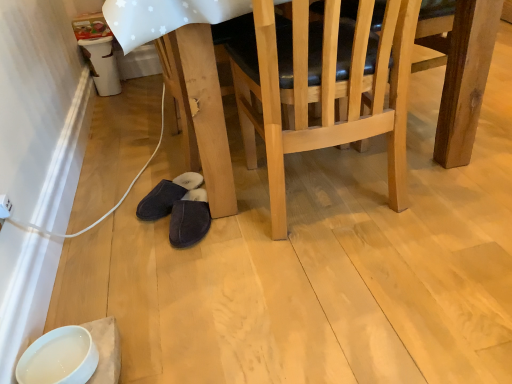
Question: From a real-world perspective, is dark suede slippers at lower center, the first footwear when ordered from right to left, positioned over natural wood chair at center based on gravity?

Choices:
 (A) no
 (B) yes

Answer: (A)

Question: Is dark suede slippers at lower center, arranged as the second footwear when viewed from the left, beside natural wood chair at center?

Choices:
 (A) no
 (B) yes

Answer: (A)

Question: From the image's perspective, is dark suede slippers at lower center, the first footwear when ordered from right to left, under natural wood chair at center?

Choices:
 (A) no
 (B) yes

Answer: (B)

Question: Is dark suede slippers at lower center, the first footwear when ordered from right to left, at the right side of natural wood chair at center?

Choices:
 (A) no
 (B) yes

Answer: (A)

Question: Can you confirm if dark suede slippers at lower center, the first footwear when ordered from right to left, is thinner than natural wood chair at center?

Choices:
 (A) no
 (B) yes

Answer: (B)

Question: From the image's perspective, is wooden table at lower center positioned above or below dark suede slippers at lower center, the first footwear when ordered from right to left?

Choices:
 (A) below
 (B) above

Answer: (B)

Question: In the image, is wooden table at lower center positioned in front of or behind dark suede slippers at lower center, arranged as the second footwear when viewed from the left?

Choices:
 (A) front
 (B) behind

Answer: (A)

Question: Choose the correct answer: Is wooden table at lower center inside dark suede slippers at lower center, the first footwear when ordered from right to left, or outside it?

Choices:
 (A) outside
 (B) inside

Answer: (A)

Question: Does point (115, 29) appear closer or farther from the camera than point (187, 228)?

Choices:
 (A) closer
 (B) farther

Answer: (A)

Question: Considering the positions of point (185, 205) and point (192, 51), is point (185, 205) closer or farther from the camera than point (192, 51)?

Choices:
 (A) closer
 (B) farther

Answer: (B)

Question: Is dark suede slippers at lower center, the first footwear when ordered from right to left, to the left or to the right of wooden table at lower center in the image?

Choices:
 (A) left
 (B) right

Answer: (A)

Question: In terms of width, does dark suede slippers at lower center, arranged as the second footwear when viewed from the left, look wider or thinner when compared to wooden table at lower center?

Choices:
 (A) wide
 (B) thin

Answer: (B)

Question: From a real-world perspective, relative to wooden table at lower center, is dark suede slippers at lower center, the first footwear when ordered from right to left, vertically above or below?

Choices:
 (A) below
 (B) above

Answer: (A)

Question: From a real-world perspective, relative to natural wood chair at center, is dark suede slippers at lower center, the first footwear when ordered from right to left, vertically above or below?

Choices:
 (A) above
 (B) below

Answer: (B)

Question: From the image's perspective, is dark suede slippers at lower center, the first footwear when ordered from right to left, positioned above or below natural wood chair at center?

Choices:
 (A) above
 (B) below

Answer: (B)